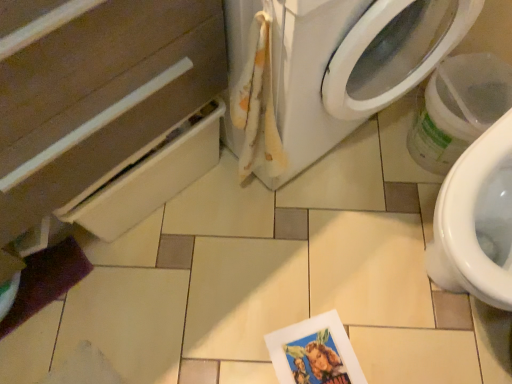
Question: Is white fabric washing machine at center to the right of printed paper postcard at lower center from the viewer's perspective?

Choices:
 (A) no
 (B) yes

Answer: (A)

Question: From a real-world perspective, is white fabric washing machine at center located higher than printed paper postcard at lower center?

Choices:
 (A) yes
 (B) no

Answer: (A)

Question: Is printed paper postcard at lower center inside white fabric washing machine at center?

Choices:
 (A) yes
 (B) no

Answer: (B)

Question: Does white fabric washing machine at center have a greater height compared to printed paper postcard at lower center?

Choices:
 (A) no
 (B) yes

Answer: (B)

Question: From the image's perspective, is white fabric washing machine at center beneath printed paper postcard at lower center?

Choices:
 (A) yes
 (B) no

Answer: (B)

Question: Is white fabric washing machine at center directly adjacent to printed paper postcard at lower center?

Choices:
 (A) no
 (B) yes

Answer: (A)

Question: Does fluffy white towel at upper center have a lesser height compared to printed paper postcard at lower center?

Choices:
 (A) yes
 (B) no

Answer: (B)

Question: Is fluffy white towel at upper center wider than printed paper postcard at lower center?

Choices:
 (A) yes
 (B) no

Answer: (B)

Question: Is fluffy white towel at upper center to the right of printed paper postcard at lower center from the viewer's perspective?

Choices:
 (A) no
 (B) yes

Answer: (A)

Question: From a real-world perspective, is fluffy white towel at upper center beneath printed paper postcard at lower center?

Choices:
 (A) no
 (B) yes

Answer: (A)

Question: Would you say fluffy white towel at upper center is outside printed paper postcard at lower center?

Choices:
 (A) yes
 (B) no

Answer: (A)

Question: Considering the relative sizes of fluffy white towel at upper center and printed paper postcard at lower center in the image provided, is fluffy white towel at upper center thinner than printed paper postcard at lower center?

Choices:
 (A) yes
 (B) no

Answer: (A)

Question: Does matte white drawer at lower left have a lesser width compared to white fabric washing machine at center?

Choices:
 (A) yes
 (B) no

Answer: (A)